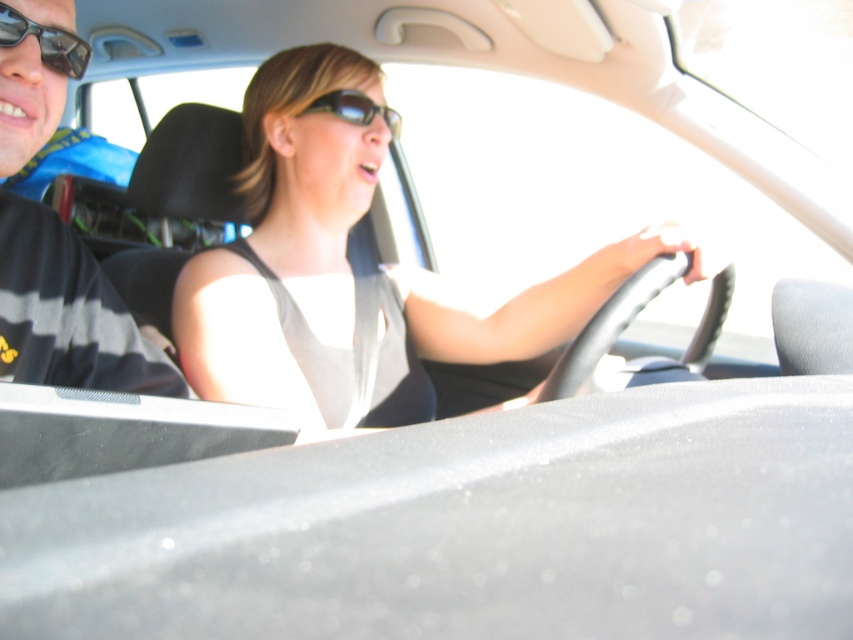
Is white fabric tank top at center taller than sunglasses at center?

Correct, white fabric tank top at center is much taller as sunglasses at center.

Between point (190, 333) and point (329, 92), which one is positioned in front?

Positioned in front is point (190, 333).

Is point (352, 353) behind point (341, 118)?

No, it is not.

The image size is (853, 640). In order to click on white fabric tank top at center in this screenshot , I will do `click(354, 269)`.

Can you confirm if white fabric tank top at center is thinner than matte black sunglasses at upper left?

In fact, white fabric tank top at center might be wider than matte black sunglasses at upper left.

Is point (254, 266) more distant than point (39, 58)?

That is True.

Is point (566, 326) closer to viewer compared to point (10, 12)?

No, (566, 326) is behind (10, 12).

Find the location of a particular element. This screenshot has width=853, height=640. white fabric tank top at center is located at coordinates (354, 269).

Which is behind, point (16, 328) or point (339, 106)?

Point (339, 106)

Between black striped shirt at left and sunglasses at center, which one appears on the right side from the viewer's perspective?

sunglasses at center is more to the right.

This screenshot has height=640, width=853. What are the coordinates of `black striped shirt at left` in the screenshot? It's located at (67, 312).